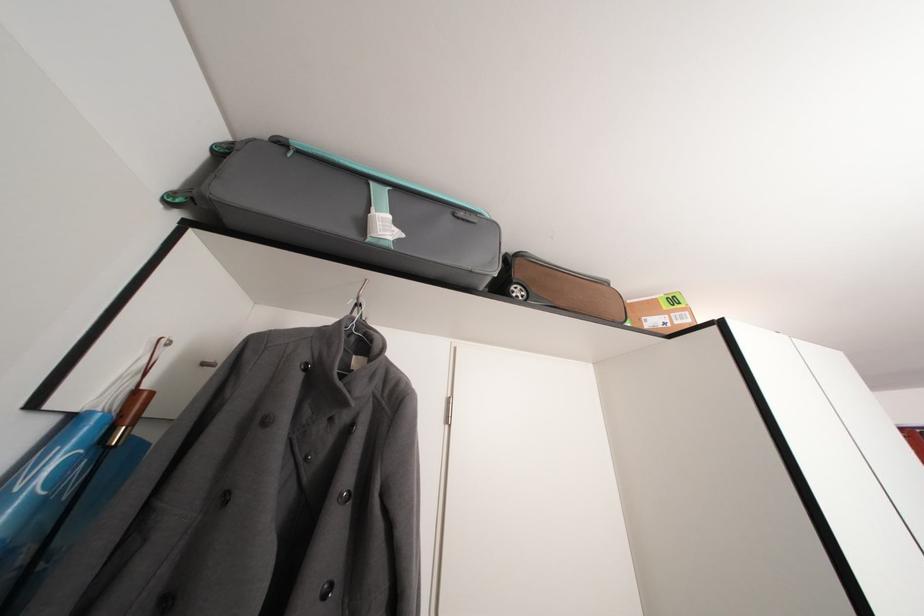
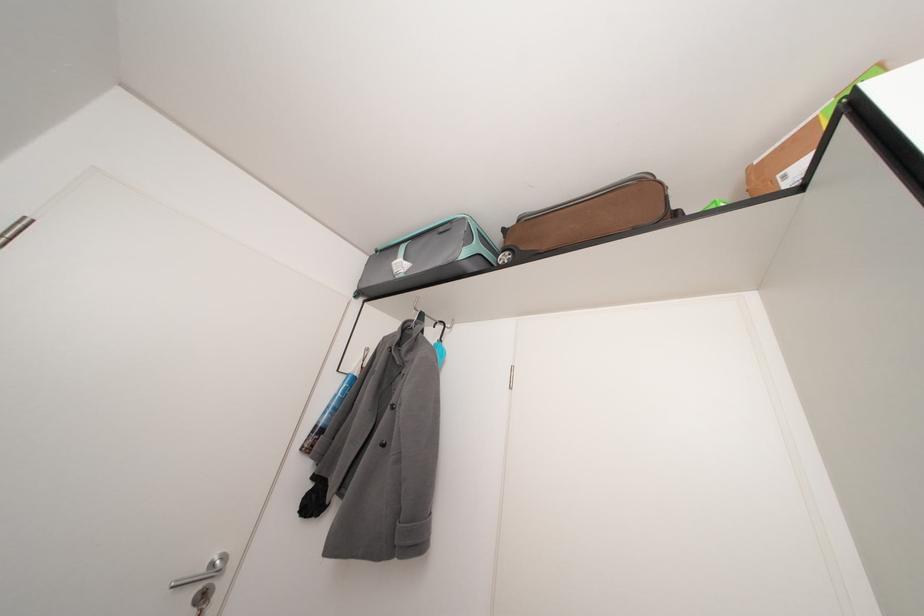
Where in the second image is the point corresponding to (x=526, y=293) from the first image?

(514, 257)